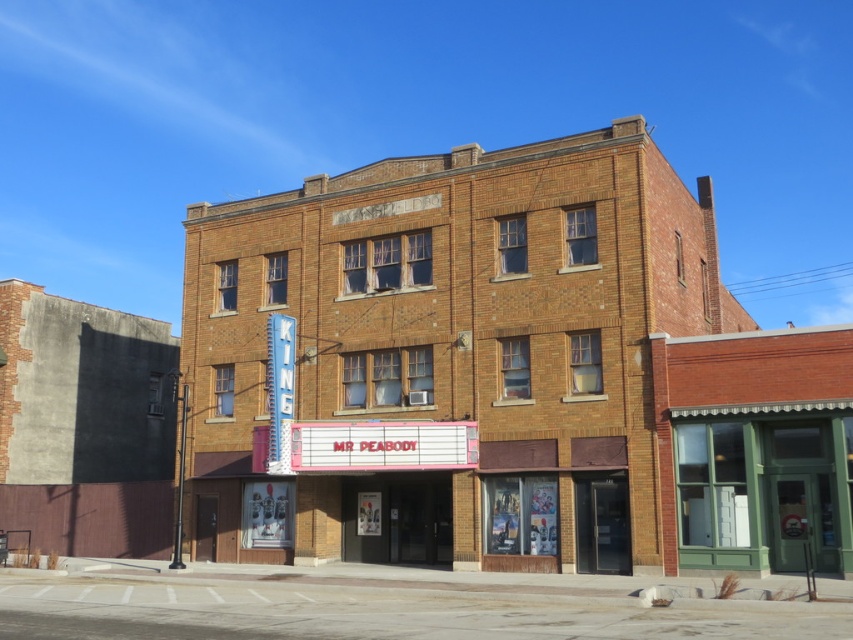
Question: Does brown brick theater at center have a larger size compared to green painted wood storefront at center?

Choices:
 (A) no
 (B) yes

Answer: (B)

Question: Where is brown brick theater at center located in relation to green painted wood storefront at center in the image?

Choices:
 (A) above
 (B) below

Answer: (A)

Question: Among these points, which one is farthest from the camera?

Choices:
 (A) (848, 452)
 (B) (328, 493)

Answer: (B)

Question: Considering the relative positions of brown brick theater at center and green painted wood storefront at center in the image provided, where is brown brick theater at center located with respect to green painted wood storefront at center?

Choices:
 (A) left
 (B) right

Answer: (A)

Question: Which object is closer to the camera taking this photo?

Choices:
 (A) green painted wood storefront at center
 (B) brown brick theater at center

Answer: (A)